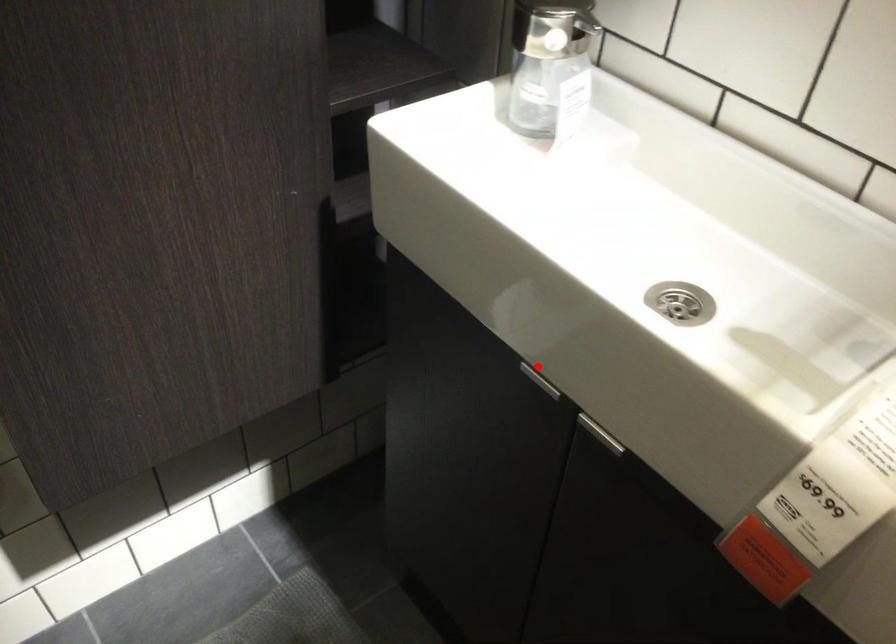
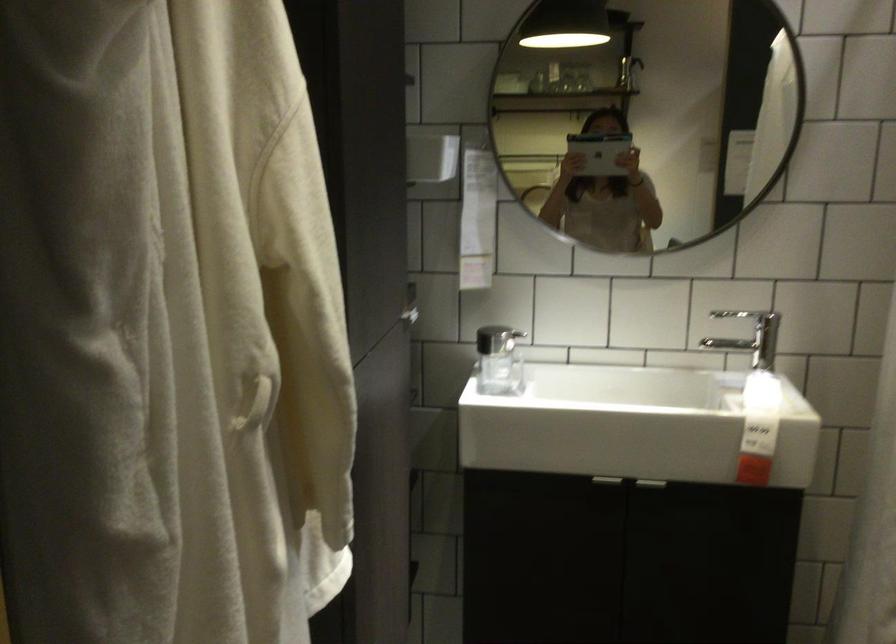
Question: A red point is marked in image1. In image2, is the corresponding 3D point closer to the camera or farther? Reply with the corresponding letter.

Choices:
 (A) The corresponding 3D point is closer.
 (B) The corresponding 3D point is farther.

Answer: (B)